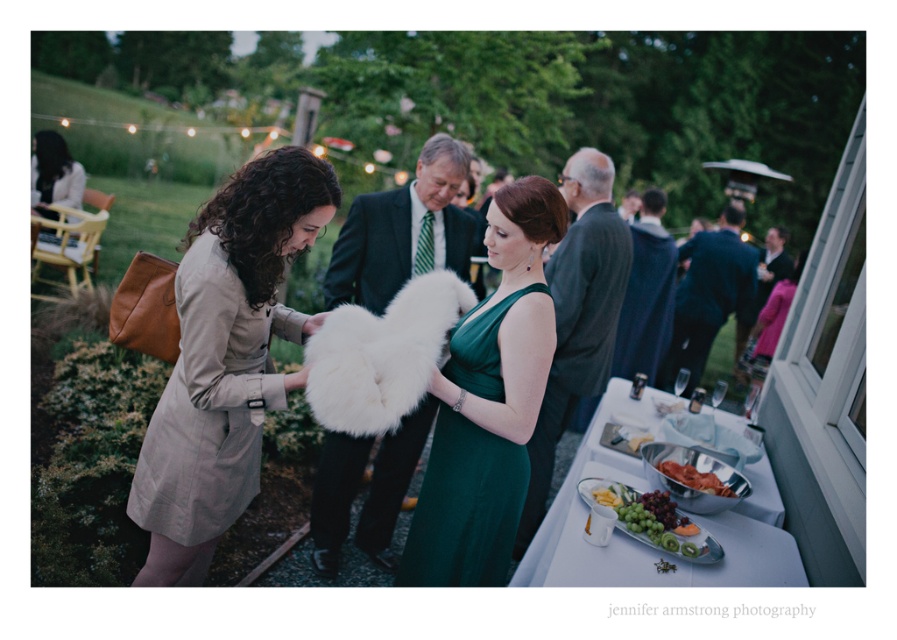
Looking at this image, is light beige fabric dress at center to the left of dark gray suit at center from the viewer's perspective?

Yes, light beige fabric dress at center is to the left of dark gray suit at center.

Does light beige fabric dress at center have a greater height compared to dark gray suit at center?

In fact, light beige fabric dress at center may be shorter than dark gray suit at center.

Does point (207, 296) lie in front of point (554, 390)?

Yes, point (207, 296) is closer to viewer.

The width and height of the screenshot is (897, 640). I want to click on light beige fabric dress at center, so click(225, 358).

Is dark suit at center closer to the viewer compared to dark blue wool coat at center?

Yes.

Measure the distance between point (340, 522) and camera.

Point (340, 522) is 3.37 meters away from camera.

Find the location of `dark suit at center`. dark suit at center is located at coordinates (405, 230).

Is emerald satin dress at center positioned in front of smooth white cheese at lower center?

Yes, it is.

Does emerald satin dress at center lie behind smooth white cheese at lower center?

No.

Which is in front, point (482, 337) or point (646, 433)?

Point (482, 337) is more forward.

Find the location of `emerald satin dress at center`. emerald satin dress at center is located at coordinates (488, 403).